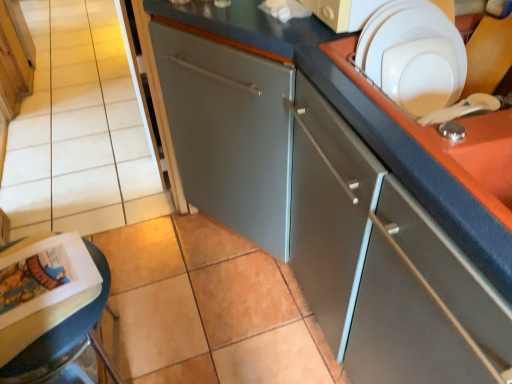
Question: Can we say matte wood cabinet at upper left, the 1th cabinetry viewed from the top, lies outside white glossy plate at upper right?

Choices:
 (A) yes
 (B) no

Answer: (A)

Question: From the image's perspective, is matte wood cabinet at upper left, acting as the 2th cabinetry starting from the right, on white glossy plate at upper right?

Choices:
 (A) no
 (B) yes

Answer: (B)

Question: Is white glossy plate at upper right at the back of matte wood cabinet at upper left, the first cabinetry viewed from the left?

Choices:
 (A) no
 (B) yes

Answer: (A)

Question: Does matte wood cabinet at upper left, the first cabinetry from the back, have a greater height compared to white glossy plate at upper right?

Choices:
 (A) yes
 (B) no

Answer: (A)

Question: Does matte wood cabinet at upper left, the first cabinetry from the back, have a lesser height compared to white glossy plate at upper right?

Choices:
 (A) no
 (B) yes

Answer: (A)

Question: Is matte wood cabinet at upper left, acting as the 2th cabinetry starting from the right, further to the viewer compared to white glossy plate at upper right?

Choices:
 (A) yes
 (B) no

Answer: (A)

Question: Is matte paper magazine at lower left facing towards white glossy plate at upper right?

Choices:
 (A) yes
 (B) no

Answer: (B)

Question: Would you say white glossy plate at upper right is part of matte paper magazine at lower left's contents?

Choices:
 (A) no
 (B) yes

Answer: (A)

Question: Is matte paper magazine at lower left wider than white glossy plate at upper right?

Choices:
 (A) yes
 (B) no

Answer: (A)

Question: Does matte paper magazine at lower left lie behind white glossy plate at upper right?

Choices:
 (A) no
 (B) yes

Answer: (B)

Question: Is matte paper magazine at lower left at the left side of white glossy plate at upper right?

Choices:
 (A) yes
 (B) no

Answer: (A)

Question: Considering the relative positions of matte paper magazine at lower left and white glossy plate at upper right in the image provided, is matte paper magazine at lower left to the right of white glossy plate at upper right from the viewer's perspective?

Choices:
 (A) yes
 (B) no

Answer: (B)

Question: From a real-world perspective, is white glossy plate at upper right located beneath matte wood cabinet at upper left, marked as the 2th cabinetry in a front-to-back arrangement?

Choices:
 (A) no
 (B) yes

Answer: (A)